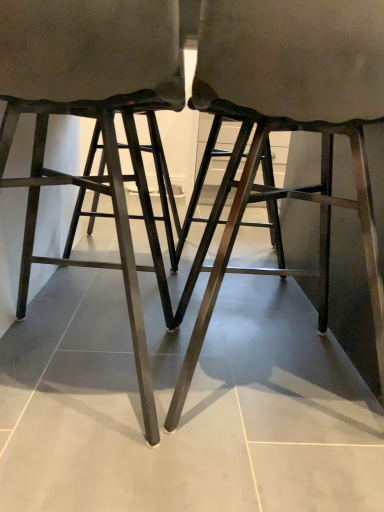
This screenshot has height=512, width=384. What are the coordinates of `matte black stool at center, the 1th stool in the left-to-right sequence` in the screenshot? It's located at (89, 112).

Image resolution: width=384 pixels, height=512 pixels. What do you see at coordinates (89, 112) in the screenshot?
I see `matte black stool at center, positioned as the second stool in right-to-left order` at bounding box center [89, 112].

Measure the distance between matte black stool at center, positioned as the second stool in right-to-left order, and camera.

matte black stool at center, positioned as the second stool in right-to-left order, and camera are 22.98 inches apart from each other.

This screenshot has width=384, height=512. Describe the element at coordinates (291, 114) in the screenshot. I see `metallic dark brown stool at center, arranged as the first stool when viewed from the right` at that location.

This screenshot has height=512, width=384. Identify the location of metallic dark brown stool at center, positioned as the 2th stool in left-to-right order. (291, 114).

The image size is (384, 512). I want to click on matte black stool at center, the 1th stool in the left-to-right sequence, so click(x=89, y=112).

Visually, is matte black stool at center, the 1th stool in the left-to-right sequence, positioned to the left or to the right of metallic dark brown stool at center, arranged as the first stool when viewed from the right?

Clearly, matte black stool at center, the 1th stool in the left-to-right sequence, is on the left of metallic dark brown stool at center, arranged as the first stool when viewed from the right, in the image.

Which object is closer to the camera, matte black stool at center, the 1th stool in the left-to-right sequence, or metallic dark brown stool at center, positioned as the 2th stool in left-to-right order?

matte black stool at center, the 1th stool in the left-to-right sequence, is in front.

Consider the image. Which is closer to the camera, [128,302] or [339,129]?

The point [128,302] is in front.

From the image's perspective, which one is positioned lower, matte black stool at center, positioned as the second stool in right-to-left order, or metallic dark brown stool at center, arranged as the first stool when viewed from the right?

metallic dark brown stool at center, arranged as the first stool when viewed from the right, appears lower in the image.

From a real-world perspective, which is physically above, matte black stool at center, the 1th stool in the left-to-right sequence, or metallic dark brown stool at center, arranged as the first stool when viewed from the right?

A: From a 3D spatial view, metallic dark brown stool at center, arranged as the first stool when viewed from the right, is above.

Considering the sizes of objects matte black stool at center, positioned as the second stool in right-to-left order, and metallic dark brown stool at center, positioned as the 2th stool in left-to-right order, in the image provided, who is thinner, matte black stool at center, positioned as the second stool in right-to-left order, or metallic dark brown stool at center, positioned as the 2th stool in left-to-right order,?

matte black stool at center, positioned as the second stool in right-to-left order, is thinner.

Which of these two, matte black stool at center, positioned as the second stool in right-to-left order, or metallic dark brown stool at center, arranged as the first stool when viewed from the right, stands shorter?

matte black stool at center, positioned as the second stool in right-to-left order, is shorter.

Considering the sizes of matte black stool at center, positioned as the second stool in right-to-left order, and metallic dark brown stool at center, positioned as the 2th stool in left-to-right order, in the image, is matte black stool at center, positioned as the second stool in right-to-left order, bigger or smaller than metallic dark brown stool at center, positioned as the 2th stool in left-to-right order,?

Clearly, matte black stool at center, positioned as the second stool in right-to-left order, is smaller in size than metallic dark brown stool at center, positioned as the 2th stool in left-to-right order.

Is matte black stool at center, positioned as the second stool in right-to-left order, outside of metallic dark brown stool at center, positioned as the 2th stool in left-to-right order?

Yes, matte black stool at center, positioned as the second stool in right-to-left order, is located beyond the bounds of metallic dark brown stool at center, positioned as the 2th stool in left-to-right order.

Can you see matte black stool at center, the 1th stool in the left-to-right sequence, touching metallic dark brown stool at center, arranged as the first stool when viewed from the right?

No, matte black stool at center, the 1th stool in the left-to-right sequence, is not next to metallic dark brown stool at center, arranged as the first stool when viewed from the right.

Is matte black stool at center, positioned as the second stool in right-to-left order, facing towards metallic dark brown stool at center, arranged as the first stool when viewed from the right?

No, matte black stool at center, positioned as the second stool in right-to-left order, is not facing towards metallic dark brown stool at center, arranged as the first stool when viewed from the right.

Locate an element on the screen. The height and width of the screenshot is (512, 384). stool lying on the right of matte black stool at center, the 1th stool in the left-to-right sequence is located at coordinates (291, 114).

From the picture: Based on their positions, is metallic dark brown stool at center, arranged as the first stool when viewed from the right, located to the left or right of matte black stool at center, the 1th stool in the left-to-right sequence?

metallic dark brown stool at center, arranged as the first stool when viewed from the right, is to the right of matte black stool at center, the 1th stool in the left-to-right sequence.

Which object is further away from the camera taking this photo, metallic dark brown stool at center, positioned as the 2th stool in left-to-right order, or matte black stool at center, the 1th stool in the left-to-right sequence?

metallic dark brown stool at center, positioned as the 2th stool in left-to-right order, is behind.

Which is closer, [344,2] or [154,8]?

Clearly, point [344,2] is closer to the camera than point [154,8].

From the image's perspective, which is below, metallic dark brown stool at center, positioned as the 2th stool in left-to-right order, or matte black stool at center, positioned as the second stool in right-to-left order?

metallic dark brown stool at center, positioned as the 2th stool in left-to-right order.

From a real-world perspective, who is located lower, metallic dark brown stool at center, positioned as the 2th stool in left-to-right order, or matte black stool at center, the 1th stool in the left-to-right sequence?

From a 3D spatial view, matte black stool at center, the 1th stool in the left-to-right sequence, is below.

In the scene shown: Can you confirm if metallic dark brown stool at center, arranged as the first stool when viewed from the right, is thinner than matte black stool at center, the 1th stool in the left-to-right sequence?

Incorrect, the width of metallic dark brown stool at center, arranged as the first stool when viewed from the right, is not less than that of matte black stool at center, the 1th stool in the left-to-right sequence.

Considering the sizes of objects metallic dark brown stool at center, arranged as the first stool when viewed from the right, and matte black stool at center, positioned as the second stool in right-to-left order, in the image provided, who is shorter, metallic dark brown stool at center, arranged as the first stool when viewed from the right, or matte black stool at center, positioned as the second stool in right-to-left order,?

matte black stool at center, positioned as the second stool in right-to-left order, is shorter.

Does metallic dark brown stool at center, positioned as the 2th stool in left-to-right order, have a smaller size compared to matte black stool at center, the 1th stool in the left-to-right sequence?

No, metallic dark brown stool at center, positioned as the 2th stool in left-to-right order, is not smaller than matte black stool at center, the 1th stool in the left-to-right sequence.

Is metallic dark brown stool at center, arranged as the first stool when viewed from the right, completely or partially outside of matte black stool at center, positioned as the second stool in right-to-left order?

Yes, metallic dark brown stool at center, arranged as the first stool when viewed from the right, is outside of matte black stool at center, positioned as the second stool in right-to-left order.

Is metallic dark brown stool at center, positioned as the 2th stool in left-to-right order, with matte black stool at center, the 1th stool in the left-to-right sequence?

No, metallic dark brown stool at center, positioned as the 2th stool in left-to-right order, is not with matte black stool at center, the 1th stool in the left-to-right sequence.

Is metallic dark brown stool at center, positioned as the 2th stool in left-to-right order, aimed at matte black stool at center, positioned as the second stool in right-to-left order?

No, metallic dark brown stool at center, positioned as the 2th stool in left-to-right order, is not aimed at matte black stool at center, positioned as the second stool in right-to-left order.

How different are the orientations of metallic dark brown stool at center, arranged as the first stool when viewed from the right, and matte black stool at center, positioned as the second stool in right-to-left order, in degrees?

There is a 0.00046-degree angle between the facing directions of metallic dark brown stool at center, arranged as the first stool when viewed from the right, and matte black stool at center, positioned as the second stool in right-to-left order.

How distant is metallic dark brown stool at center, positioned as the 2th stool in left-to-right order, from matte black stool at center, the 1th stool in the left-to-right sequence?

metallic dark brown stool at center, positioned as the 2th stool in left-to-right order, is 10.10 inches from matte black stool at center, the 1th stool in the left-to-right sequence.

In order to click on stool below the matte black stool at center, positioned as the second stool in right-to-left order (from the image's perspective) in this screenshot , I will do `click(291, 114)`.

This screenshot has width=384, height=512. Find the location of `stool in front of the metallic dark brown stool at center, arranged as the first stool when viewed from the right`. stool in front of the metallic dark brown stool at center, arranged as the first stool when viewed from the right is located at coordinates (89, 112).

Image resolution: width=384 pixels, height=512 pixels. In order to click on stool above the metallic dark brown stool at center, arranged as the first stool when viewed from the right (from the image's perspective) in this screenshot , I will do `click(89, 112)`.